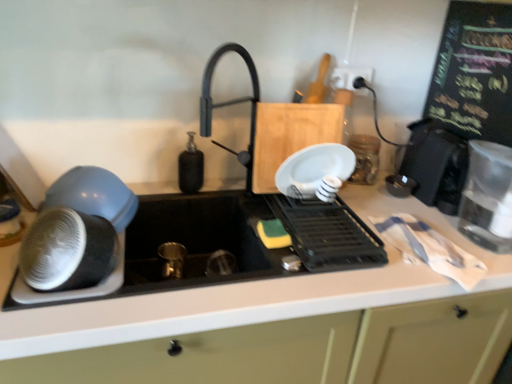
You are a GUI agent. You are given a task and a screenshot of the screen. Output one action in this format:
    pyautogui.click(x=<x>, y=<y>)
    Task: Click on the free spot to the right of black matte soap dispenser at center
    
    Given the screenshot: What is the action you would take?
    pyautogui.click(x=228, y=195)